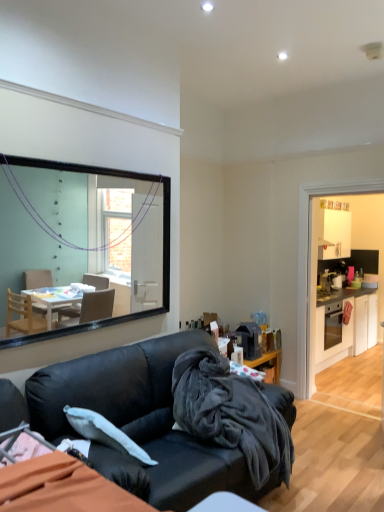
Question: Is the depth of velvety dark gray blanket at center greater than that of white glossy dresser at right?

Choices:
 (A) no
 (B) yes

Answer: (A)

Question: From a real-world perspective, is velvety dark gray blanket at center positioned over white glossy dresser at right based on gravity?

Choices:
 (A) yes
 (B) no

Answer: (B)

Question: Is velvety dark gray blanket at center wider than white glossy dresser at right?

Choices:
 (A) no
 (B) yes

Answer: (B)

Question: From a real-world perspective, is velvety dark gray blanket at center positioned under white glossy dresser at right based on gravity?

Choices:
 (A) yes
 (B) no

Answer: (A)

Question: Does velvety dark gray blanket at center lie in front of white glossy dresser at right?

Choices:
 (A) no
 (B) yes

Answer: (B)

Question: From the image's perspective, does velvety dark gray blanket at center appear lower than white glossy dresser at right?

Choices:
 (A) yes
 (B) no

Answer: (A)

Question: Can you confirm if white glossy cabinets at right is positioned to the left of velvety dark gray blanket at center?

Choices:
 (A) no
 (B) yes

Answer: (A)

Question: Is white glossy cabinets at right further to the viewer compared to velvety dark gray blanket at center?

Choices:
 (A) no
 (B) yes

Answer: (B)

Question: From a real-world perspective, is white glossy cabinets at right physically below velvety dark gray blanket at center?

Choices:
 (A) yes
 (B) no

Answer: (A)

Question: Is white glossy cabinets at right far from velvety dark gray blanket at center?

Choices:
 (A) no
 (B) yes

Answer: (B)

Question: Considering the relative sizes of white glossy cabinets at right and velvety dark gray blanket at center in the image provided, is white glossy cabinets at right smaller than velvety dark gray blanket at center?

Choices:
 (A) yes
 (B) no

Answer: (B)

Question: Is white glossy cabinets at right closer to camera compared to velvety dark gray blanket at center?

Choices:
 (A) no
 (B) yes

Answer: (A)

Question: Could you tell me if white glossy dresser at right is turned towards velvety dark gray blanket at center?

Choices:
 (A) no
 (B) yes

Answer: (B)